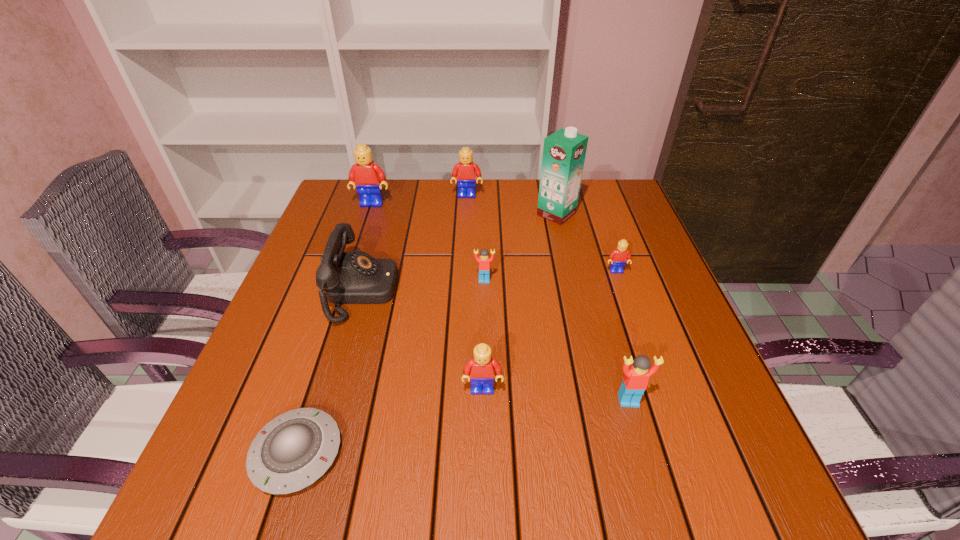
At what (x,y) coordinates should I click in order to perform the action: click on object present at the near left corner. Please return your answer as a coordinate pair (x, y). This screenshot has width=960, height=540. Looking at the image, I should click on (292, 451).

I want to click on vacant space at the near edge of the desktop, so click(x=448, y=511).

Where is `free space at the left edge of the desktop`? This screenshot has width=960, height=540. free space at the left edge of the desktop is located at coordinates (301, 319).

The height and width of the screenshot is (540, 960). In order to click on free region at the right edge of the desktop in this screenshot , I will do 656,328.

In the image, there is a desktop. What are the coordinates of `vacant space at the far left corner` in the screenshot? It's located at (359, 197).

The height and width of the screenshot is (540, 960). I want to click on vacant space at the near right corner of the desktop, so coord(689,478).

At what (x,y) coordinates should I click in order to perform the action: click on free point between the third biggest yellow Lego and the saucer. Please return your answer as a coordinate pair (x, y). The width and height of the screenshot is (960, 540). Looking at the image, I should click on click(x=390, y=421).

Locate an element on the screen. empty space that is in between the second smallest yellow Lego and the smallest yellow Lego is located at coordinates (549, 330).

Locate an element on the screen. free space between the left red Lego and the rightmost Lego is located at coordinates (550, 275).

At what (x,y) coordinates should I click in order to perform the action: click on vacant space that is in between the rightmost yellow Lego and the gray telephone. Please return your answer as a coordinate pair (x, y). The height and width of the screenshot is (540, 960). Looking at the image, I should click on (490, 281).